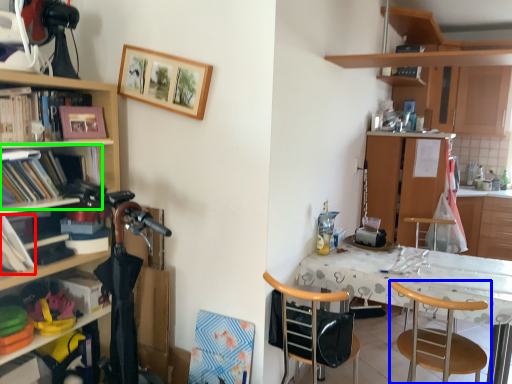
Question: Which object is positioned closest to book (highlighted by a red box)? Select from chair (highlighted by a blue box) and shelf (highlighted by a green box).

Choices:
 (A) chair
 (B) shelf

Answer: (B)